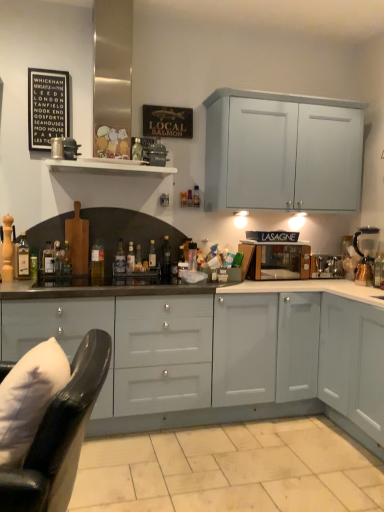
Question: Is translucent glass bottle at center, which is the 8th bottle from right to left, bigger than black paper at upper left?

Choices:
 (A) yes
 (B) no

Answer: (B)

Question: From a real-world perspective, is translucent glass bottle at center, the 4th bottle when ordered from left to right, under black paper at upper left?

Choices:
 (A) yes
 (B) no

Answer: (A)

Question: Is translucent glass bottle at center, the 4th bottle when ordered from left to right, smaller than black paper at upper left?

Choices:
 (A) yes
 (B) no

Answer: (A)

Question: Is translucent glass bottle at center, the 4th bottle when ordered from left to right, positioned with its back to black paper at upper left?

Choices:
 (A) yes
 (B) no

Answer: (B)

Question: Is translucent glass bottle at center, the 4th bottle when ordered from left to right, located outside black paper at upper left?

Choices:
 (A) yes
 (B) no

Answer: (A)

Question: From a real-world perspective, is matte brown microwave at center, the first appliance in the left-to-right sequence, physically located above or below translucent glass bottle at center, the 4th bottle when ordered from left to right?

Choices:
 (A) below
 (B) above

Answer: (B)

Question: From the image's perspective, is matte brown microwave at center, the first appliance in the left-to-right sequence, above or below translucent glass bottle at center, the 4th bottle when ordered from left to right?

Choices:
 (A) below
 (B) above

Answer: (A)

Question: Looking at the image, does matte brown microwave at center, the second appliance viewed from the right, seem bigger or smaller compared to translucent glass bottle at center, the 4th bottle when ordered from left to right?

Choices:
 (A) big
 (B) small

Answer: (A)

Question: Which is correct: matte brown microwave at center, the second appliance viewed from the right, is inside translucent glass bottle at center, which is the 8th bottle from right to left, or outside of it?

Choices:
 (A) inside
 (B) outside

Answer: (B)

Question: In terms of size, does translucent glass bottle at left, which is the 10th bottle in right-to-left order, appear bigger or smaller than translucent glass bottle at center, arranged as the 8th bottle when viewed from the left?

Choices:
 (A) small
 (B) big

Answer: (B)

Question: Looking at their shapes, would you say translucent glass bottle at left, which is the 10th bottle in right-to-left order, is wider or thinner than translucent glass bottle at center, which ranks as the 4th bottle in right-to-left order?

Choices:
 (A) thin
 (B) wide

Answer: (B)

Question: Considering the positions of translucent glass bottle at left, which is the 10th bottle in right-to-left order, and translucent glass bottle at center, which ranks as the 4th bottle in right-to-left order, in the image, is translucent glass bottle at left, which is the 10th bottle in right-to-left order, taller or shorter than translucent glass bottle at center, which ranks as the 4th bottle in right-to-left order,?

Choices:
 (A) tall
 (B) short

Answer: (A)

Question: From the image's perspective, is translucent glass bottle at left, which is counted as the 2th bottle, starting from the left, above or below translucent glass bottle at center, arranged as the 8th bottle when viewed from the left?

Choices:
 (A) above
 (B) below

Answer: (A)

Question: Is point (102, 474) positioned closer to the camera than point (152, 173)?

Choices:
 (A) closer
 (B) farther

Answer: (A)

Question: From a real-world perspective, is beige tile at lower center physically located above or below white wooden shelf at upper center?

Choices:
 (A) below
 (B) above

Answer: (A)